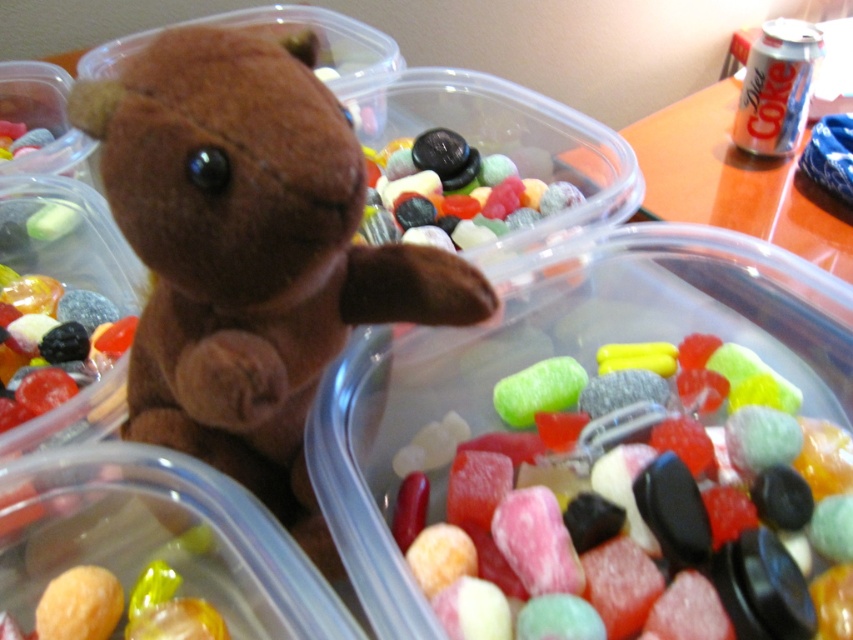
You are a delivery robot trying to place a package at the exact center of the wooden surface where the can of Diet Coke is located. The coordinates given are in normalized image coordinates. Is the point at coordinates point (250,253) on the wooden surface where the can of Diet Coke is located?

The point (250,253) indicates the brown plush toy at center, which is not on the wooden surface where the can of Diet Coke is located. Therefore, the package should not be placed there.

You are looking at the image and want to determine which of the two points, point (213, 52) or point (662, 344), is closer to you. Based on the scene, which point is nearer?

Point (213, 52) is closer to the viewer than point (662, 344).

Consider the image. You are a delivery robot with a 20 inch wide package. You need to place the package between the brown plush toy at center and the glossy black rock at center. Is there enough space between them to fit the package?

The brown plush toy at center and glossy black rock at center are 19.82 inches apart. Since the package is 20 inches wide, it is slightly wider than the space available. Therefore, the package cannot fit between them.